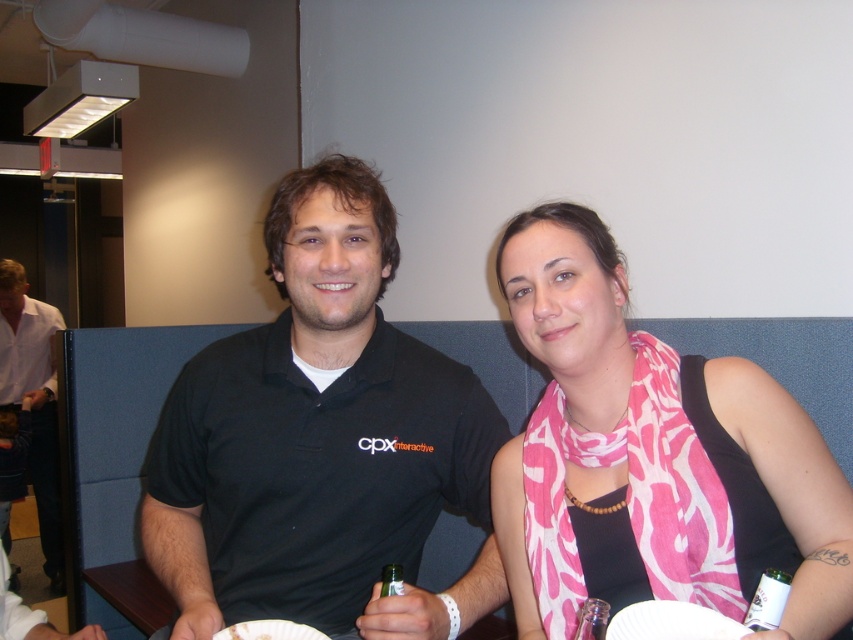
Which is above, pink printed scarf at center or white shirt at left?

Positioned higher is pink printed scarf at center.

Locate an element on the screen. The image size is (853, 640). pink printed scarf at center is located at coordinates (653, 458).

The width and height of the screenshot is (853, 640). What are the coordinates of `pink printed scarf at center` in the screenshot? It's located at (653, 458).

Between point (645, 435) and point (399, 586), which one is positioned in front?

Point (399, 586)

Who is shorter, pink printed scarf at center or clear plastic bottle at center?

clear plastic bottle at center

Between point (686, 381) and point (383, 579), which one is positioned behind?

The point (686, 381) is more distant.

Identify the location of pink printed scarf at center. (653, 458).

Is black polo shirt at center thinner than clear plastic bottle at center?

Incorrect, black polo shirt at center's width is not less than clear plastic bottle at center's.

Consider the image. Between black polo shirt at center and clear plastic bottle at center, which one has less height?

clear plastic bottle at center

You are a GUI agent. You are given a task and a screenshot of the screen. Output one action in this format:
    pyautogui.click(x=<x>, y=<y>)
    Task: Click on the black polo shirt at center
    The height and width of the screenshot is (640, 853).
    Given the screenshot: What is the action you would take?
    pyautogui.click(x=320, y=442)